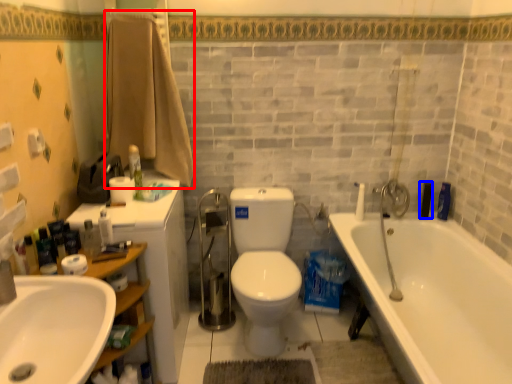
Question: Which object appears farthest to the camera in this image, bath towel (highlighted by a red box) or toiletry (highlighted by a blue box)?

Choices:
 (A) bath towel
 (B) toiletry

Answer: (B)